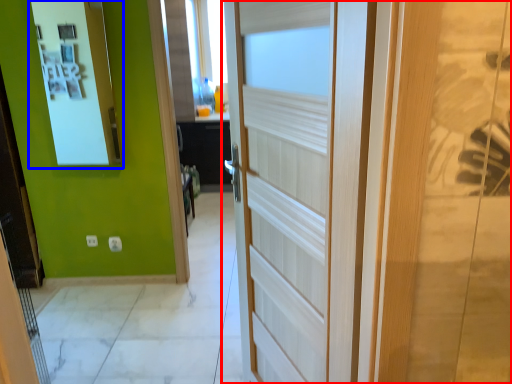
Question: Among these objects, which one is farthest to the camera, door (highlighted by a red box) or medicine cabinet (highlighted by a blue box)?

Choices:
 (A) door
 (B) medicine cabinet

Answer: (B)